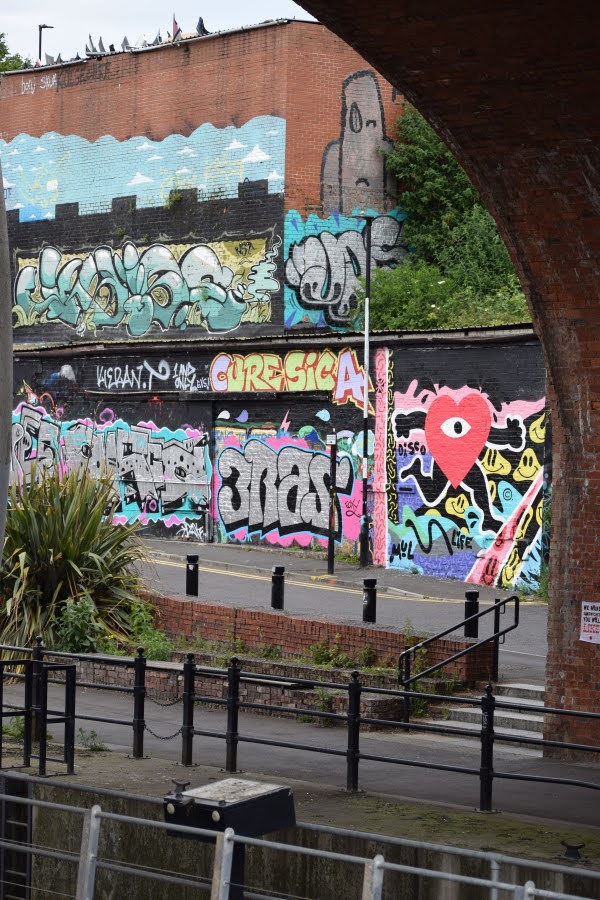
Identify the location of black iron rail. (424, 641).